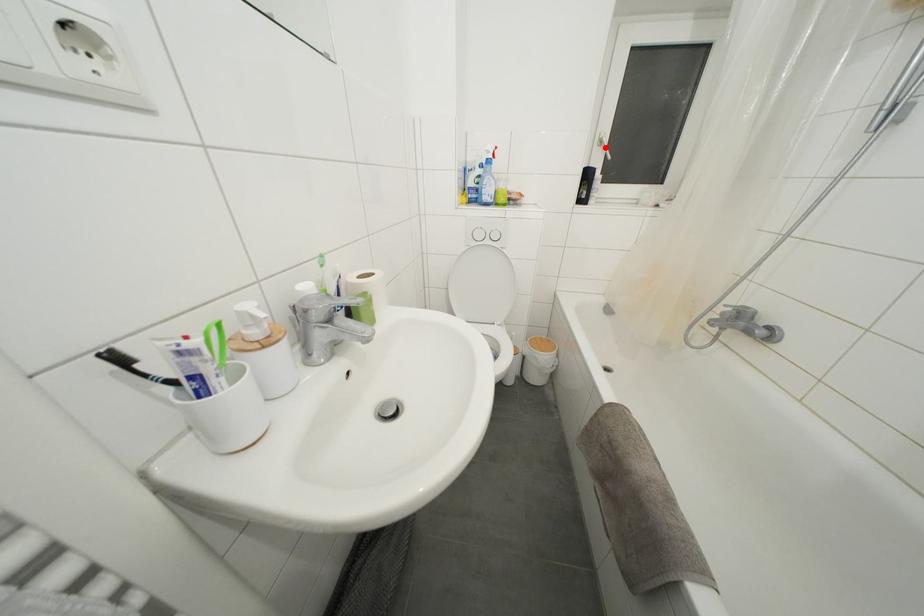
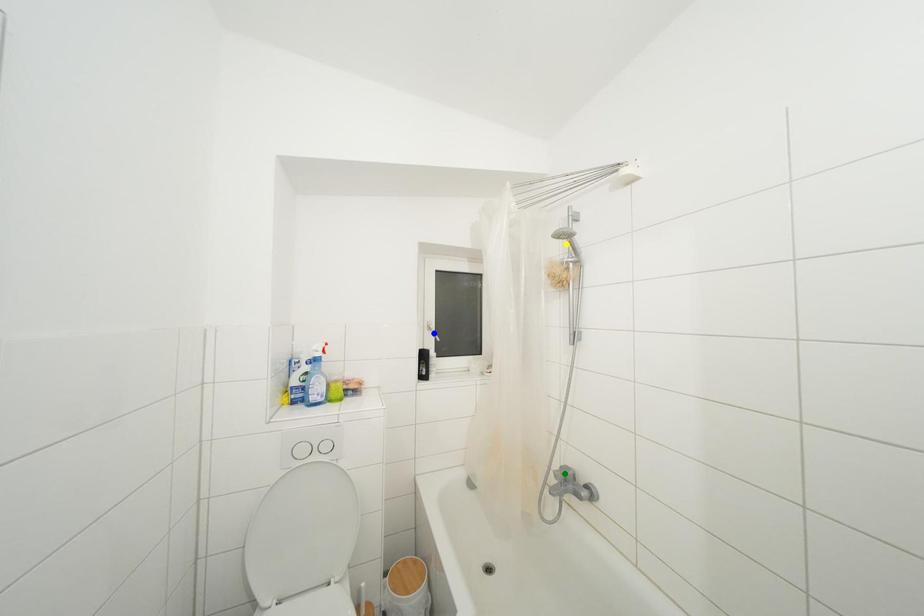
Question: I am providing you with two images of the same scene from different viewpoints. A red point is marked on the first image. You are given multiple points on the second image. In image 2, which mark is for the same physical point as the one in image 1?

Choices:
 (A) green point
 (B) yellow point
 (C) blue point

Answer: (C)